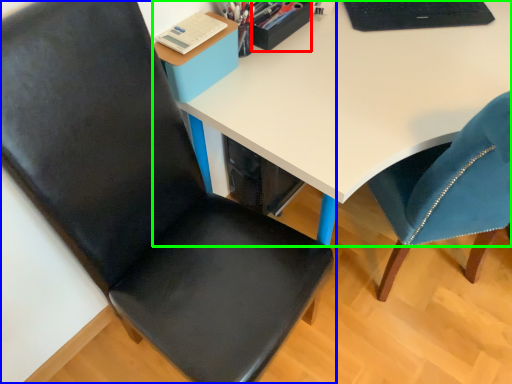
Question: Which object is positioned farthest from stationery (highlighted by a red box)? Select from chair (highlighted by a blue box) and desk (highlighted by a green box).

Choices:
 (A) chair
 (B) desk

Answer: (A)